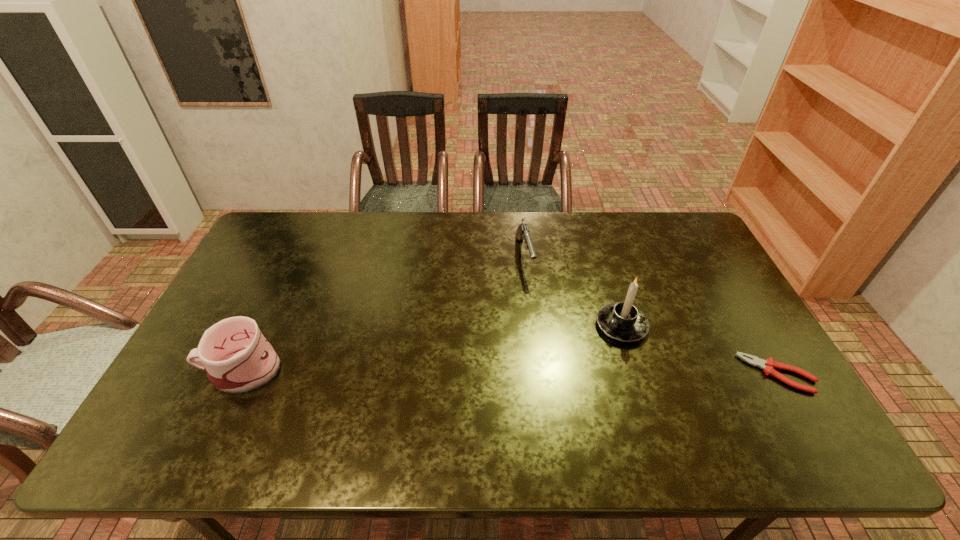
At what (x,y) coordinates should I click in order to perform the action: click on object located at the right edge. Please return your answer as a coordinate pair (x, y). The width and height of the screenshot is (960, 540). Looking at the image, I should click on (768, 365).

Where is `object present at the near left corner`? The image size is (960, 540). object present at the near left corner is located at coordinates (237, 357).

Where is `object located at the near right corner`? The height and width of the screenshot is (540, 960). object located at the near right corner is located at coordinates (768, 365).

The height and width of the screenshot is (540, 960). Identify the location of vacant space at the far edge of the desktop. (403, 233).

You are a GUI agent. You are given a task and a screenshot of the screen. Output one action in this format:
    pyautogui.click(x=<x>, y=<y>)
    Task: Click on the vacant space at the near edge of the desktop
    The width and height of the screenshot is (960, 540).
    Given the screenshot: What is the action you would take?
    pyautogui.click(x=383, y=397)

Find the location of a particular element. The height and width of the screenshot is (540, 960). free region at the left edge of the desktop is located at coordinates (270, 288).

In the image, there is a desktop. What are the coordinates of `free space at the right edge` in the screenshot? It's located at (716, 366).

In the image, there is a desktop. What are the coordinates of `vacant space at the far left corner` in the screenshot? It's located at (266, 233).

This screenshot has width=960, height=540. What are the coordinates of `vacant space at the far right corner of the desktop` in the screenshot? It's located at [x=655, y=234].

Identify the location of free space between the second object from left to right and the pliers. This screenshot has height=540, width=960. (651, 315).